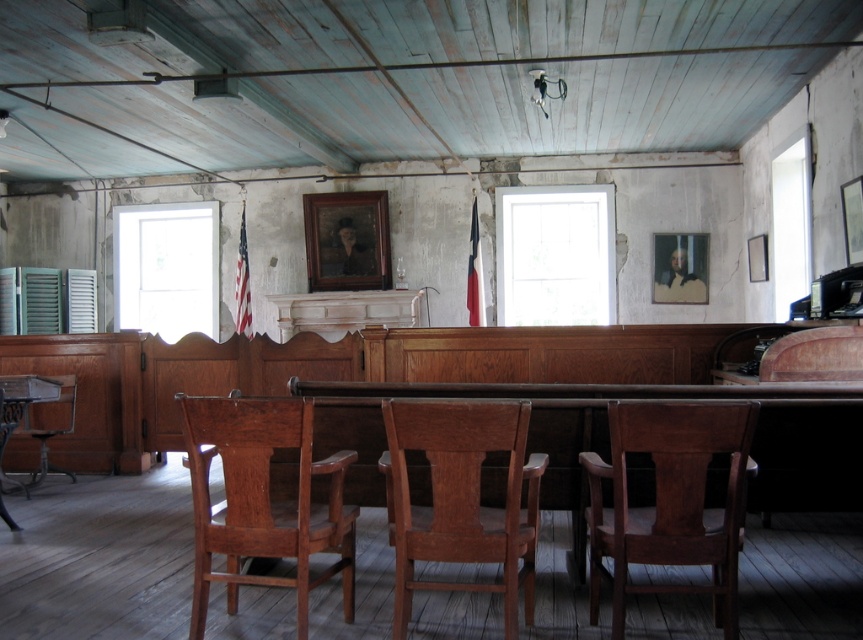
Question: Considering the relative positions of wooden chair at left and wooden chair at lower left in the image provided, where is wooden chair at left located with respect to wooden chair at lower left?

Choices:
 (A) above
 (B) below

Answer: (B)

Question: Among these points, which one is nearest to the camera?

Choices:
 (A) (67, 400)
 (B) (16, 529)
 (C) (83, 296)
 (D) (217, 435)

Answer: (D)

Question: In this image, where is polished wood chair at center located relative to wooden chair at center?

Choices:
 (A) right
 (B) left

Answer: (A)

Question: Among these objects, which one is nearest to the camera?

Choices:
 (A) wooden chair at left
 (B) white matte shutter at left
 (C) wooden chair at center

Answer: (C)

Question: Is wooden chair at left further to the viewer compared to wooden chair at lower left?

Choices:
 (A) no
 (B) yes

Answer: (B)

Question: Which object appears closest to the camera in this image?

Choices:
 (A) wooden chair at lower left
 (B) wooden chair at center
 (C) wooden chair at left
 (D) white painted wood shutter at left

Answer: (B)